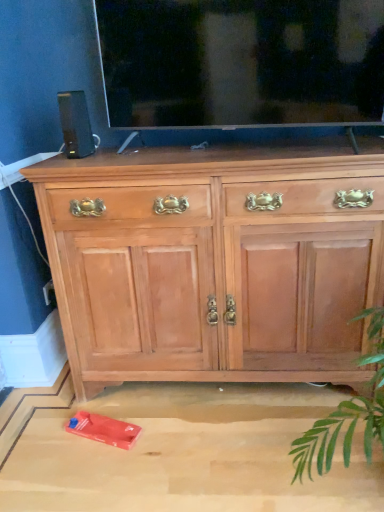
Question: Can you confirm if transparent glass tv at upper center is taller than light wood cabinet at center?

Choices:
 (A) yes
 (B) no

Answer: (B)

Question: From a real-world perspective, is transparent glass tv at upper center on top of light wood cabinet at center?

Choices:
 (A) yes
 (B) no

Answer: (A)

Question: Does transparent glass tv at upper center have a smaller size compared to light wood cabinet at center?

Choices:
 (A) no
 (B) yes

Answer: (B)

Question: From a real-world perspective, does transparent glass tv at upper center sit lower than light wood cabinet at center?

Choices:
 (A) no
 (B) yes

Answer: (A)

Question: Is transparent glass tv at upper center not within light wood cabinet at center?

Choices:
 (A) no
 (B) yes

Answer: (B)

Question: In the image, is transparent glass tv at upper center on the left side or the right side of black plastic speaker at upper left?

Choices:
 (A) left
 (B) right

Answer: (B)

Question: Is point (205, 56) closer or farther from the camera than point (72, 131)?

Choices:
 (A) closer
 (B) farther

Answer: (A)

Question: In terms of height, does transparent glass tv at upper center look taller or shorter compared to black plastic speaker at upper left?

Choices:
 (A) short
 (B) tall

Answer: (B)

Question: From a real-world perspective, is transparent glass tv at upper center above or below black plastic speaker at upper left?

Choices:
 (A) above
 (B) below

Answer: (A)

Question: From a real-world perspective, is light wood cabinet at center above or below transparent glass tv at upper center?

Choices:
 (A) below
 (B) above

Answer: (A)

Question: Do you think light wood cabinet at center is within transparent glass tv at upper center, or outside of it?

Choices:
 (A) outside
 (B) inside

Answer: (A)

Question: Is light wood cabinet at center bigger or smaller than transparent glass tv at upper center?

Choices:
 (A) small
 (B) big

Answer: (B)

Question: Would you say light wood cabinet at center is to the left or to the right of transparent glass tv at upper center in the picture?

Choices:
 (A) left
 (B) right

Answer: (A)

Question: Looking at their shapes, would you say transparent glass tv at upper center is wider or thinner than light wood cabinet at center?

Choices:
 (A) thin
 (B) wide

Answer: (A)

Question: Considering the relative positions of transparent glass tv at upper center and light wood cabinet at center in the image provided, is transparent glass tv at upper center to the left or to the right of light wood cabinet at center?

Choices:
 (A) right
 (B) left

Answer: (A)